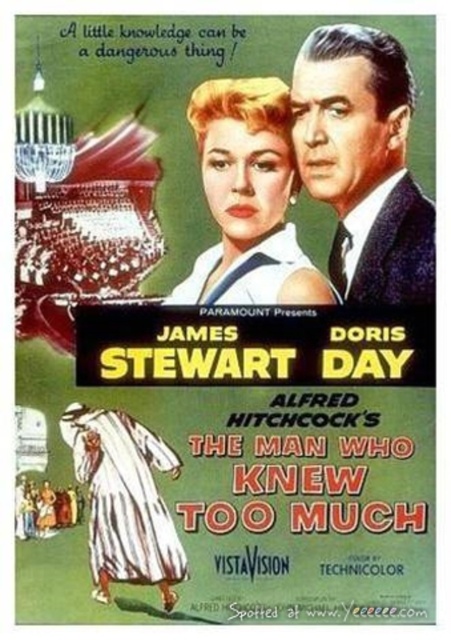
Which is in front, point (351, 115) or point (205, 109)?

Point (351, 115)

From the picture: Can you confirm if smooth black suit at upper right is bigger than matte blonde hair at center?

Correct, smooth black suit at upper right is larger in size than matte blonde hair at center.

Is point (395, 84) positioned after point (290, 196)?

That is False.

At what (x,y) coordinates should I click in order to perform the action: click on smooth black suit at upper right. Please return your answer as a coordinate pair (x, y). Looking at the image, I should click on (363, 161).